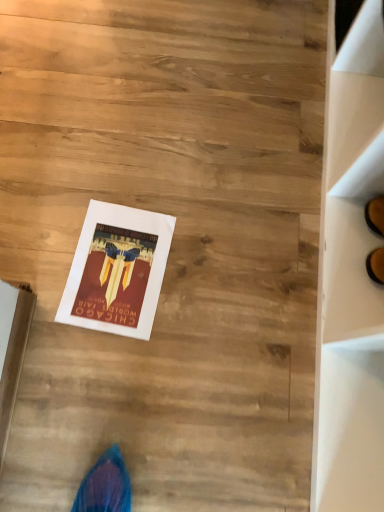
Find the location of a particular element. free space to the left of matte paper poster at center is located at coordinates (39, 234).